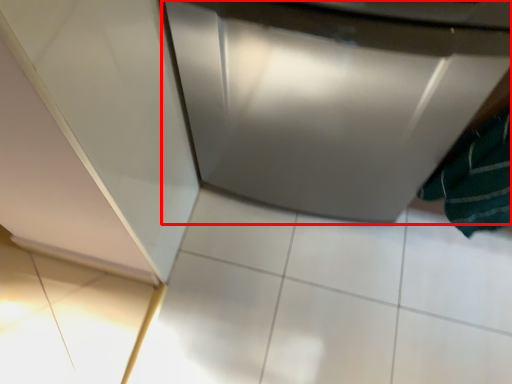
Question: From the image, what is the correct spatial relationship of home appliance (annotated by the red box) in relation to bath towel?

Choices:
 (A) right
 (B) left

Answer: (B)